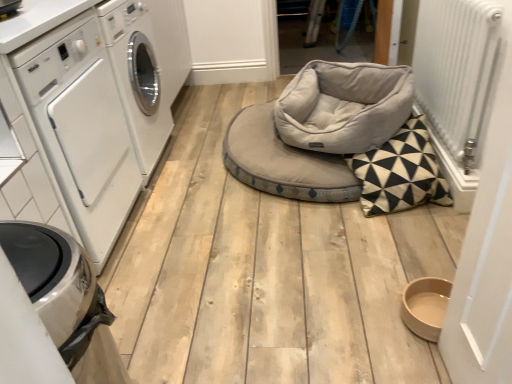
Image resolution: width=512 pixels, height=384 pixels. Identify the location of white metallic radiator at right. (458, 71).

The height and width of the screenshot is (384, 512). Identify the location of light gray plush bean bag chair at center. click(344, 106).

This screenshot has width=512, height=384. Describe the element at coordinates (344, 106) in the screenshot. I see `light gray plush bean bag chair at center` at that location.

What do you see at coordinates (319, 129) in the screenshot? I see `soft gray fabric daybed at center` at bounding box center [319, 129].

The height and width of the screenshot is (384, 512). I want to click on white glossy washing machine at left, so [x=81, y=127].

Where is `white metallic radiator at right`? The image size is (512, 384). white metallic radiator at right is located at coordinates (458, 71).

Can you confirm if white glossy washing machine at left is shorter than soft gray fabric daybed at center?

Incorrect, the height of white glossy washing machine at left does not fall short of that of soft gray fabric daybed at center.

Identify the location of daybed located on the right of white glossy washing machine at left. (319, 129).

Considering the sizes of objects white glossy washing machine at left and soft gray fabric daybed at center in the image provided, who is smaller, white glossy washing machine at left or soft gray fabric daybed at center?

soft gray fabric daybed at center.

Would you say soft gray fabric daybed at center contains white glossy washing machine at left?

No, white glossy washing machine at left is not a part of soft gray fabric daybed at center.

Can you tell me how much soft gray fabric daybed at center and white glossy washing machine at left differ in facing direction?

There is a 179-degree angle between the facing directions of soft gray fabric daybed at center and white glossy washing machine at left.

You are a GUI agent. You are given a task and a screenshot of the screen. Output one action in this format:
    pyautogui.click(x=<x>, y=<y>)
    Task: Click on the washing machine that is on the left side of soft gray fabric daybed at center
    Image resolution: width=512 pixels, height=384 pixels.
    Given the screenshot: What is the action you would take?
    pyautogui.click(x=81, y=127)

Who is more distant, white glossy washing machine at left or satin silver trash bin at lower left?

Positioned behind is white glossy washing machine at left.

Is white glossy washing machine at left spatially inside satin silver trash bin at lower left, or outside of it?

white glossy washing machine at left is located beyond the bounds of satin silver trash bin at lower left.

Measure the distance between white glossy washing machine at left and satin silver trash bin at lower left.

They are 73.33 centimeters apart.

Which is more to the left, white glossy washing machine at left or satin silver trash bin at lower left?

Positioned to the left is white glossy washing machine at left.

Is soft gray fabric daybed at center taller or shorter than white metallic radiator at right?

soft gray fabric daybed at center is shorter than white metallic radiator at right.

From a real-world perspective, which is physically below, soft gray fabric daybed at center or white metallic radiator at right?

soft gray fabric daybed at center is physically lower.

Is soft gray fabric daybed at center aimed at white metallic radiator at right?

No, soft gray fabric daybed at center is not aimed at white metallic radiator at right.

This screenshot has width=512, height=384. Find the location of `radiator in front of the soft gray fabric daybed at center`. radiator in front of the soft gray fabric daybed at center is located at coordinates (458, 71).

Which is more to the right, light gray plush bean bag chair at center or white glossy washing machine at left?

Positioned to the right is light gray plush bean bag chair at center.

Is light gray plush bean bag chair at center facing towards white glossy washing machine at left?

No, light gray plush bean bag chair at center is not oriented towards white glossy washing machine at left.

Considering the positions of points (367, 71) and (57, 87), is point (367, 71) closer to camera compared to point (57, 87)?

No, (367, 71) is behind (57, 87).

This screenshot has height=384, width=512. Find the location of `radiator that appears on the right of soft gray fabric daybed at center`. radiator that appears on the right of soft gray fabric daybed at center is located at coordinates (458, 71).

From the image's perspective, would you say white metallic radiator at right is shown under soft gray fabric daybed at center?

Actually, white metallic radiator at right appears above soft gray fabric daybed at center in the image.

Can you confirm if white metallic radiator at right is taller than soft gray fabric daybed at center?

Indeed, white metallic radiator at right has a greater height compared to soft gray fabric daybed at center.

Is white metallic radiator at right looking in the opposite direction of soft gray fabric daybed at center?

No, soft gray fabric daybed at center is not at the back of white metallic radiator at right.

Does point (118, 231) come farther from viewer compared to point (321, 120)?

No, it is not.

Is white glossy washing machine at left bigger than light gray plush bean bag chair at center?

Yes, white glossy washing machine at left is bigger than light gray plush bean bag chair at center.

Where is `bean bag chair behind the white glossy washing machine at left`? bean bag chair behind the white glossy washing machine at left is located at coordinates click(344, 106).

Is white glossy washing machine at left beside light gray plush bean bag chair at center?

They are not placed beside each other.

Locate an element on the screen. The width and height of the screenshot is (512, 384). daybed above the white glossy washing machine at left (from the image's perspective) is located at coordinates (319, 129).

The height and width of the screenshot is (384, 512). I want to click on washing machine that appears in front of the soft gray fabric daybed at center, so click(x=81, y=127).

Which object lies nearer to the anchor point white glossy washing machine at left, soft gray fabric daybed at center or white metallic radiator at right?

Among the two, soft gray fabric daybed at center is located nearer to white glossy washing machine at left.

Looking at the image, which one is located further to satin silver trash bin at lower left, white metallic radiator at right or light gray plush bean bag chair at center?

Based on the image, white metallic radiator at right appears to be further to satin silver trash bin at lower left.

Based on their spatial positions, is light gray plush bean bag chair at center or satin silver trash bin at lower left further from soft gray fabric daybed at center?

Among the two, satin silver trash bin at lower left is located further to soft gray fabric daybed at center.

Estimate the real-world distances between objects in this image. Which object is closer to white metallic radiator at right, light gray plush bean bag chair at center or soft gray fabric daybed at center?

light gray plush bean bag chair at center is closer to white metallic radiator at right.

Considering their positions, is white metallic radiator at right positioned further to light gray plush bean bag chair at center than white glossy washing machine at left?

white glossy washing machine at left is further to light gray plush bean bag chair at center.

Estimate the real-world distances between objects in this image. Which object is further from white metallic radiator at right, satin silver trash bin at lower left or light gray plush bean bag chair at center?

Among the two, satin silver trash bin at lower left is located further to white metallic radiator at right.

Considering their positions, is light gray plush bean bag chair at center positioned further to white metallic radiator at right than satin silver trash bin at lower left?

satin silver trash bin at lower left is positioned further to the anchor white metallic radiator at right.

From the image, which object appears to be nearer to soft gray fabric daybed at center, satin silver trash bin at lower left or light gray plush bean bag chair at center?

Based on the image, light gray plush bean bag chair at center appears to be nearer to soft gray fabric daybed at center.

This screenshot has height=384, width=512. I want to click on daybed between white glossy washing machine at left and white metallic radiator at right in the horizontal direction, so (319, 129).

Locate an element on the screen. This screenshot has height=384, width=512. bean bag chair between satin silver trash bin at lower left and white metallic radiator at right is located at coordinates (344, 106).

Locate an element on the screen. The image size is (512, 384). bean bag chair located between satin silver trash bin at lower left and soft gray fabric daybed at center in the depth direction is located at coordinates (344, 106).

The image size is (512, 384). What are the coordinates of `home appliance between white glossy washing machine at left and light gray plush bean bag chair at center from left to right` in the screenshot? It's located at (65, 298).